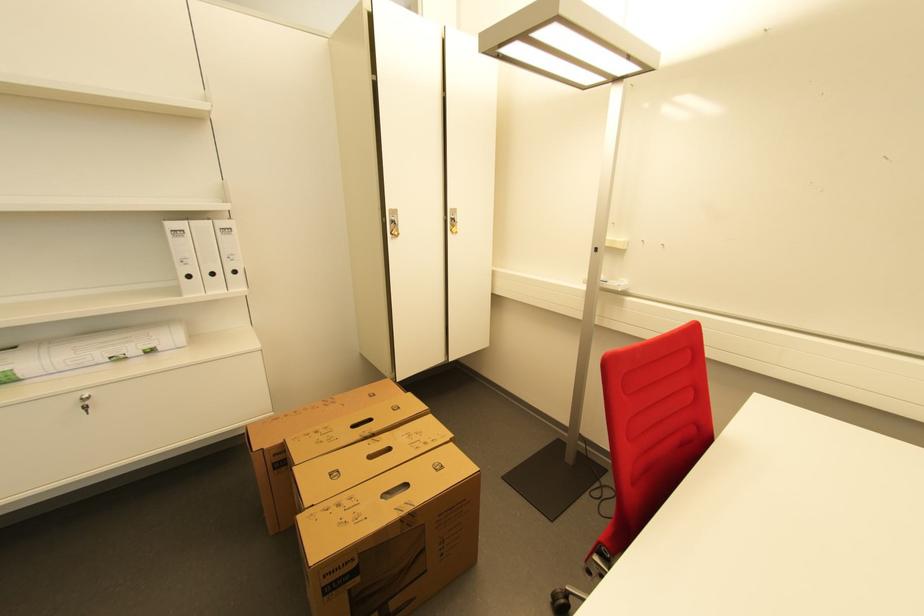
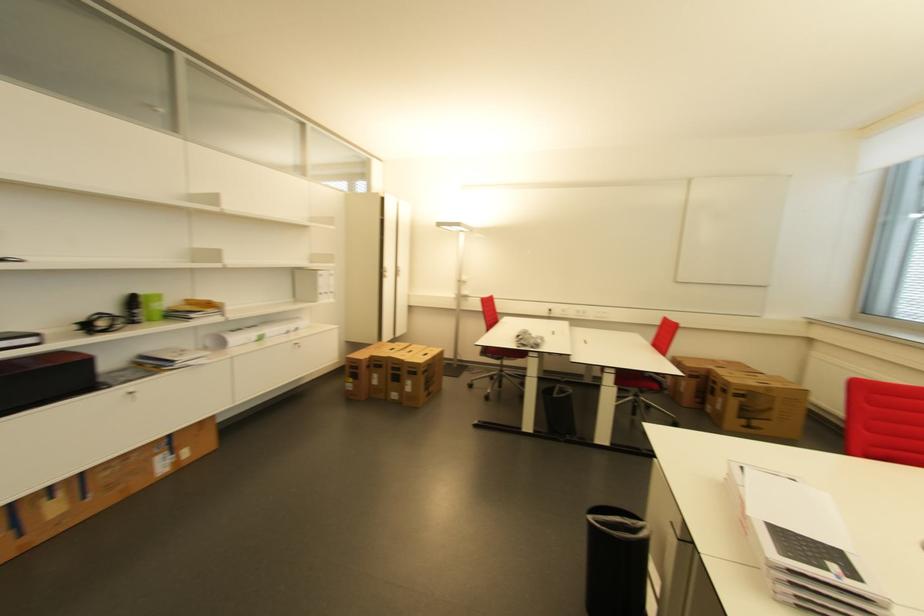
Where in the second image is the point corresponding to (x=91, y=400) from the first image?

(300, 345)